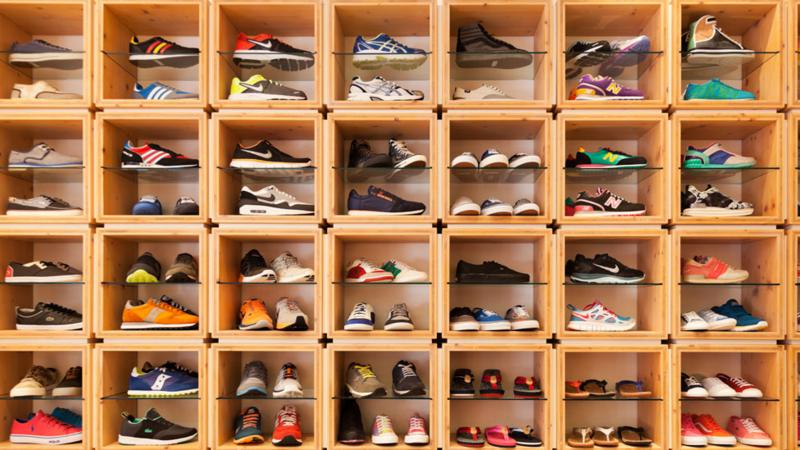
You are a GUI agent. You are given a task and a screenshot of the screen. Output one action in this format:
    pyautogui.click(x=<x>, y=<y>)
    Task: Click on the shoes on top shelf
    This screenshot has height=450, width=800.
    Given the screenshot: What is the action you would take?
    pyautogui.click(x=36, y=46), pyautogui.click(x=138, y=44), pyautogui.click(x=252, y=48), pyautogui.click(x=354, y=48), pyautogui.click(x=477, y=35), pyautogui.click(x=586, y=48), pyautogui.click(x=626, y=43), pyautogui.click(x=706, y=43)